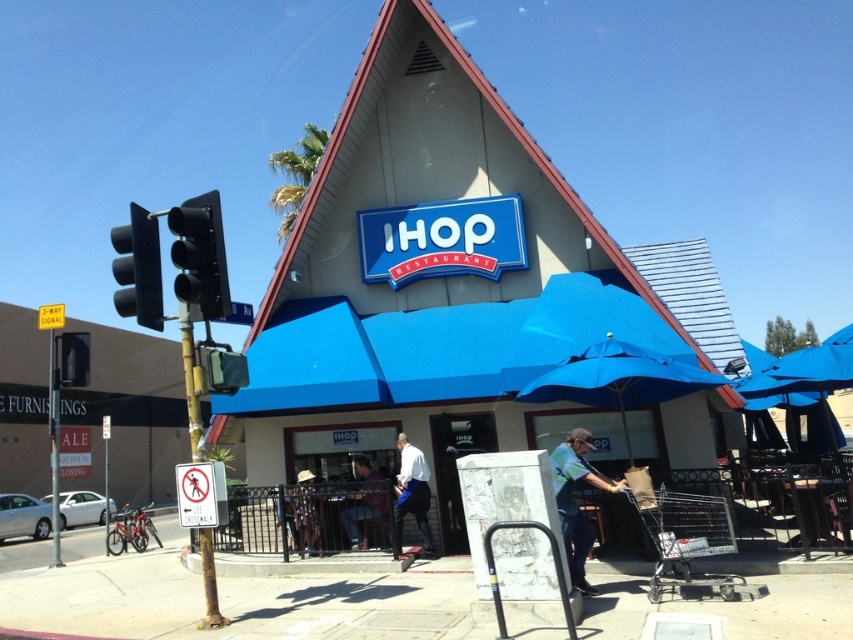
Does blue awning at center have a larger size compared to white cotton shirt at center?

Incorrect, blue awning at center is not larger than white cotton shirt at center.

Is blue awning at center positioned behind white cotton shirt at center?

Yes, blue awning at center is behind white cotton shirt at center.

The width and height of the screenshot is (853, 640). I want to click on blue awning at center, so click(445, 282).

Between point (621, 364) and point (358, 545), which one is positioned in front?

Positioned in front is point (621, 364).

Who is more distant from viewer, (662,364) or (381,483)?

The point (381,483) is more distant.

Does point (650, 358) lie in front of point (349, 512)?

Yes, it is.

Locate an element on the screen. This screenshot has width=853, height=640. blue fabric umbrella at center is located at coordinates pos(619,380).

Can you confirm if blue awning at center is wider than dark blue shirt at center?

No.

Who is taller, blue awning at center or dark blue shirt at center?

dark blue shirt at center

Is point (505, 288) behind point (370, 474)?

That is True.

This screenshot has width=853, height=640. In order to click on blue awning at center in this screenshot , I will do `click(445, 282)`.